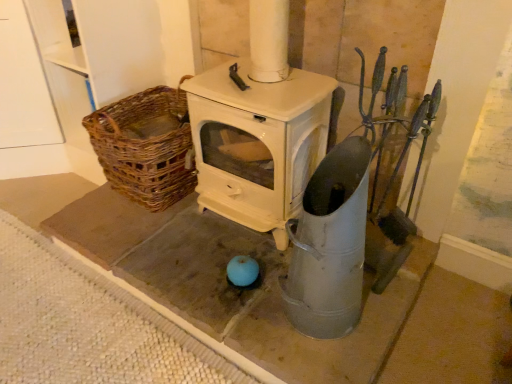
The width and height of the screenshot is (512, 384). Describe the element at coordinates (146, 146) in the screenshot. I see `woven brown basket at left` at that location.

Locate an element on the screen. The width and height of the screenshot is (512, 384). woven brown basket at left is located at coordinates (146, 146).

This screenshot has width=512, height=384. Describe the element at coordinates (329, 245) in the screenshot. I see `metallic gray bucket at center` at that location.

The height and width of the screenshot is (384, 512). I want to click on metallic gray bucket at center, so click(329, 245).

In order to face metallic gray bucket at center, should I rotate leftwards or rightwards?

Rotate your view right by about 9.343°.

The image size is (512, 384). I want to click on woven brown basket at left, so click(146, 146).

Is metallic gray bucket at center to the right of woven brown basket at left from the viewer's perspective?

Indeed, metallic gray bucket at center is positioned on the right side of woven brown basket at left.

Based on the photo, considering the positions of objects metallic gray bucket at center and woven brown basket at left in the image provided, who is behind, metallic gray bucket at center or woven brown basket at left?

woven brown basket at left.

Which point is more forward, (x=346, y=224) or (x=146, y=173)?

Positioned in front is point (x=346, y=224).

From the image's perspective, is metallic gray bucket at center above woven brown basket at left?

No, from the image's perspective, metallic gray bucket at center is not on top of woven brown basket at left.

From a real-world perspective, which is physically below, metallic gray bucket at center or woven brown basket at left?

From a 3D spatial view, woven brown basket at left is below.

Does metallic gray bucket at center have a greater width compared to woven brown basket at left?

No, metallic gray bucket at center is not wider than woven brown basket at left.

Who is shorter, metallic gray bucket at center or woven brown basket at left?

With less height is woven brown basket at left.

Consider the image. Considering the relative sizes of metallic gray bucket at center and woven brown basket at left in the image provided, is metallic gray bucket at center bigger than woven brown basket at left?

Actually, metallic gray bucket at center might be smaller than woven brown basket at left.

Which is correct: metallic gray bucket at center is inside woven brown basket at left, or outside of it?

metallic gray bucket at center is not inside woven brown basket at left, it's outside.

Is metallic gray bucket at center far away from woven brown basket at left?

No, metallic gray bucket at center is not far away from woven brown basket at left.

Based on the photo, could you tell me if metallic gray bucket at center is facing woven brown basket at left?

No, metallic gray bucket at center does not turn towards woven brown basket at left.

Identify the location of appliance that appears above the woven brown basket at left (from a real-world perspective). The width and height of the screenshot is (512, 384). 329,245.

In the image, is woven brown basket at left on the left side or the right side of metallic gray bucket at center?

Based on their positions, woven brown basket at left is located to the left of metallic gray bucket at center.

Between woven brown basket at left and metallic gray bucket at center, which one is positioned behind?

woven brown basket at left is behind.

Does point (104, 160) come in front of point (322, 237)?

No.

From the image's perspective, is woven brown basket at left on metallic gray bucket at center?

Yes, from the image's perspective, woven brown basket at left is over metallic gray bucket at center.

From a real-world perspective, is woven brown basket at left located higher than metallic gray bucket at center?

No, from a real-world perspective, woven brown basket at left is not on top of metallic gray bucket at center.

Can you confirm if woven brown basket at left is wider than metallic gray bucket at center?

Indeed, woven brown basket at left has a greater width compared to metallic gray bucket at center.

Is woven brown basket at left taller or shorter than metallic gray bucket at center?

Considering their sizes, woven brown basket at left has less height than metallic gray bucket at center.

Does woven brown basket at left have a larger size compared to metallic gray bucket at center?

Yes, woven brown basket at left is bigger than metallic gray bucket at center.

Can metallic gray bucket at center be found inside woven brown basket at left?

Definitely not — metallic gray bucket at center is not inside woven brown basket at left.

In the scene shown: Is woven brown basket at left far from metallic gray bucket at center?

No, woven brown basket at left is not far from metallic gray bucket at center.

Does woven brown basket at left turn towards metallic gray bucket at center?

No, woven brown basket at left is not facing towards metallic gray bucket at center.

The image size is (512, 384). I want to click on appliance above the woven brown basket at left (from a real-world perspective), so (x=329, y=245).

Locate an element on the screen. Image resolution: width=512 pixels, height=384 pixels. basket behind the metallic gray bucket at center is located at coordinates (146, 146).

You are a GUI agent. You are given a task and a screenshot of the screen. Output one action in this format:
    pyautogui.click(x=<x>, y=<y>)
    Task: Click on the basket located underneath the metallic gray bucket at center (from a real-world perspective)
    Image resolution: width=512 pixels, height=384 pixels.
    Given the screenshot: What is the action you would take?
    pyautogui.click(x=146, y=146)